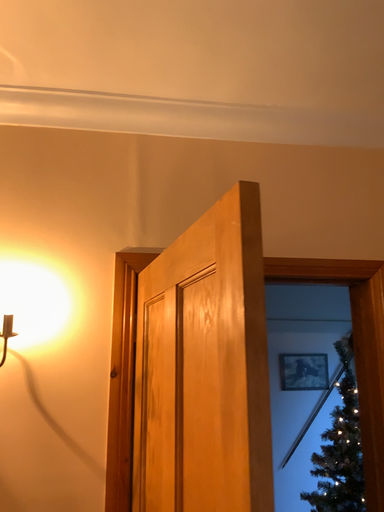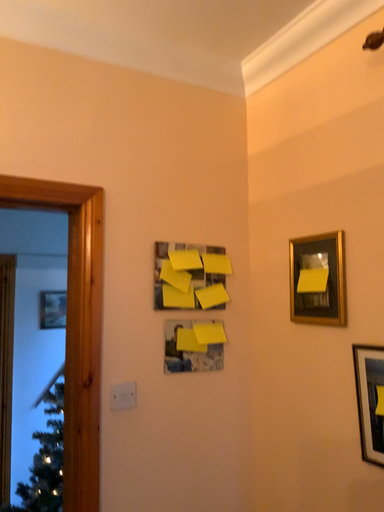
Question: How did the camera likely rotate when shooting the video?

Choices:
 (A) rotated upward
 (B) rotated downward

Answer: (B)